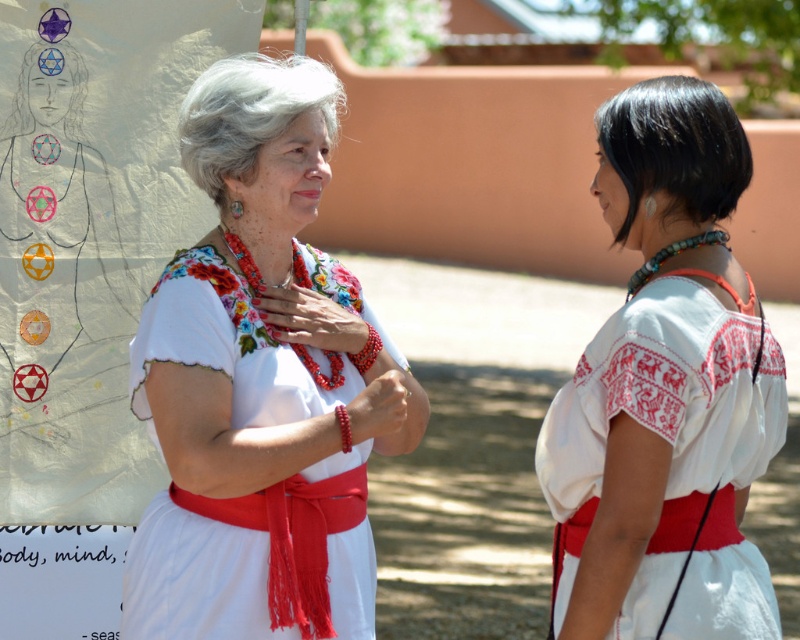
Based on the scene description, which clothing item is bigger in size between the white embroidered blouse at center and the white cotton dress at right?

The white embroidered blouse at center is larger in size compared to the white cotton dress at right according to the description.

You are a photographer trying to capture a candid shot of the two people in the scene. You want to ensure both the white embroidered blouse at center and the white cotton dress at right are clearly visible in the frame. Based on their positions, which direction should you position yourself relative to the subjects to best capture both individuals without any overlap?

Since the white embroidered blouse at center is to the left of the white cotton dress at right, positioning yourself to the left of the subjects would allow you to capture both the white embroidered blouse at center and the white cotton dress at right without overlap.

Based on the scene described, which clothing item is taller when comparing the white embroidered blouse at center and the white cotton dress at right?

The white embroidered blouse at center is taller than the white cotton dress at right.